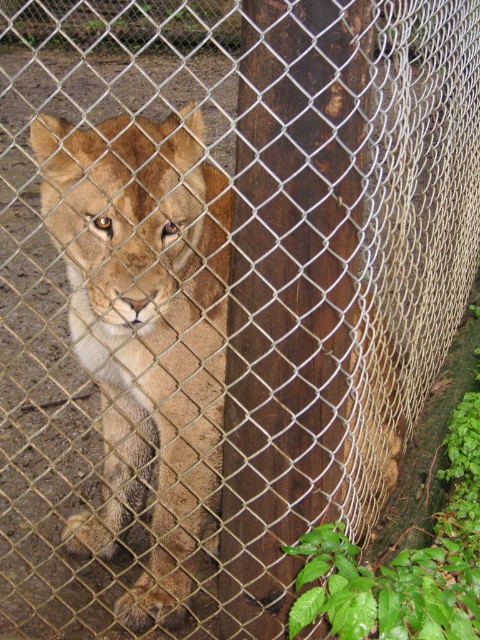
Question: Is brown wood pole at center smaller than golden fur lion at center?

Choices:
 (A) yes
 (B) no

Answer: (A)

Question: Can you confirm if brown wood pole at center is bigger than golden fur lion at center?

Choices:
 (A) yes
 (B) no

Answer: (B)

Question: Which object is farther from the camera taking this photo?

Choices:
 (A) brown wood pole at center
 (B) golden fur lion at center

Answer: (B)

Question: Can you confirm if brown wood pole at center is smaller than golden fur lion at center?

Choices:
 (A) yes
 (B) no

Answer: (A)

Question: Among these points, which one is nearest to the camera?

Choices:
 (A) (241, 44)
 (B) (143, 448)

Answer: (A)